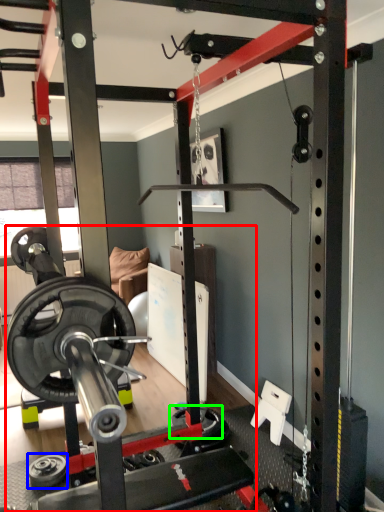
Question: Estimate the real-world distances between objects in this image. Which object is closer to barbell (highlighted by a red box), wheel (highlighted by a blue box) or wheel (highlighted by a green box)?

Choices:
 (A) wheel
 (B) wheel

Answer: (B)